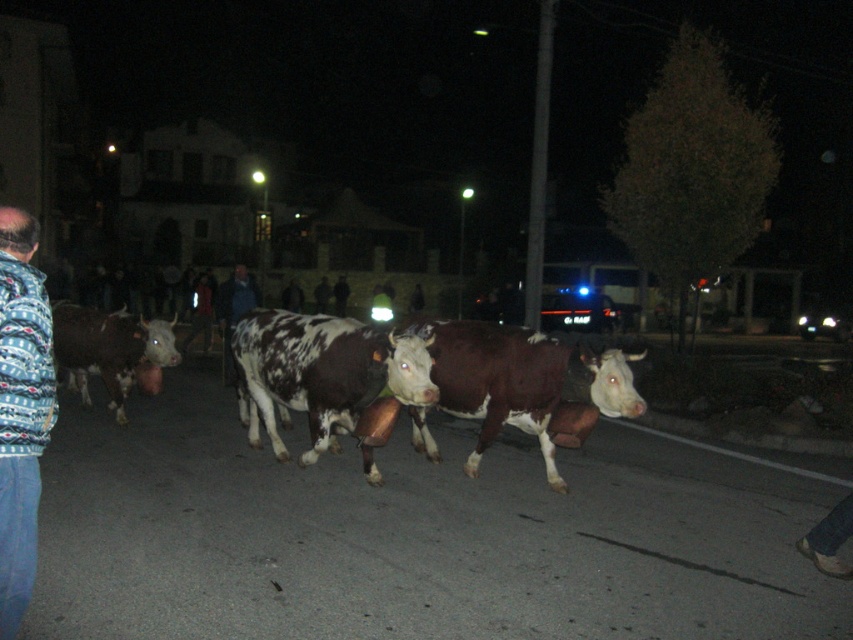
Is speckled fur bull at center positioned at the back of brown speckled cow at left?

No, speckled fur bull at center is closer to the viewer.

Between speckled fur bull at center and brown speckled cow at left, which one has more height?

brown speckled cow at left

Describe the element at coordinates (312, 371) in the screenshot. I see `speckled fur bull at center` at that location.

The width and height of the screenshot is (853, 640). I want to click on speckled fur bull at center, so click(x=312, y=371).

The width and height of the screenshot is (853, 640). What do you see at coordinates (21, 410) in the screenshot?
I see `brushed metal jacket at left` at bounding box center [21, 410].

Is brushed metal jacket at left shorter than speckled fur bull at center?

In fact, brushed metal jacket at left may be taller than speckled fur bull at center.

What do you see at coordinates (21, 410) in the screenshot?
I see `brushed metal jacket at left` at bounding box center [21, 410].

Where is `brushed metal jacket at left`? brushed metal jacket at left is located at coordinates (21, 410).

Is point (0, 548) farther from camera compared to point (126, 330)?

That is False.

Locate an element on the screen. brushed metal jacket at left is located at coordinates (21, 410).

This screenshot has width=853, height=640. Identify the location of brushed metal jacket at left. (21, 410).